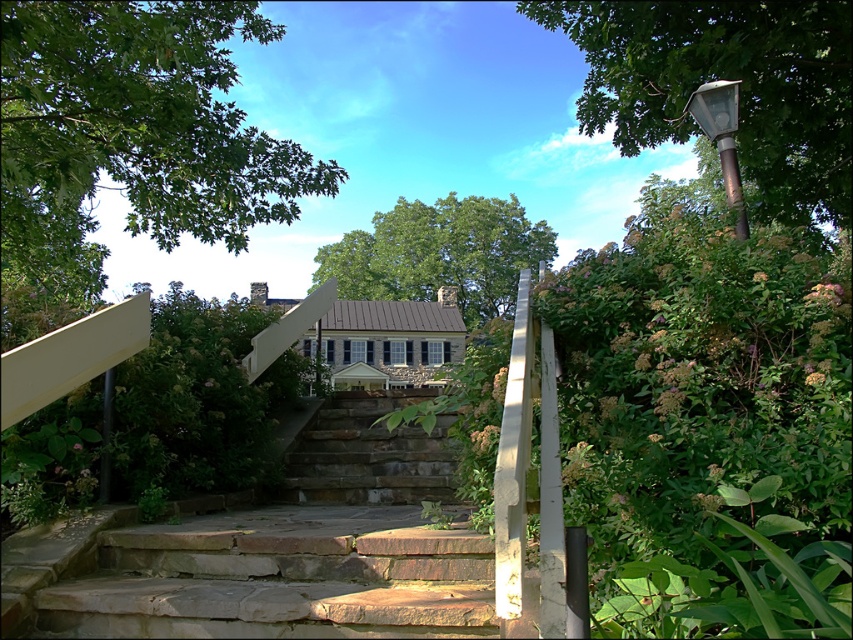
Question: Which point is farther to the camera?

Choices:
 (A) [440, 497]
 (B) [155, 541]

Answer: (A)

Question: Estimate the real-world distances between objects in this image. Which object is closer to the green leafy tree at upper left?

Choices:
 (A) green leafy tree at upper right
 (B) green leafy tree at center

Answer: (A)

Question: Does brown stone stairs at center have a greater width compared to green leafy tree at upper right?

Choices:
 (A) yes
 (B) no

Answer: (B)

Question: Which of the following is the closest to the observer?

Choices:
 (A) brown stone stairs at center
 (B) green leafy tree at upper left
 (C) green leafy tree at upper right

Answer: (A)

Question: Can you confirm if brown stone stairs at center is smaller than green leafy tree at upper right?

Choices:
 (A) yes
 (B) no

Answer: (A)

Question: Can you confirm if green leafy tree at upper left is smaller than green leafy tree at center?

Choices:
 (A) no
 (B) yes

Answer: (A)